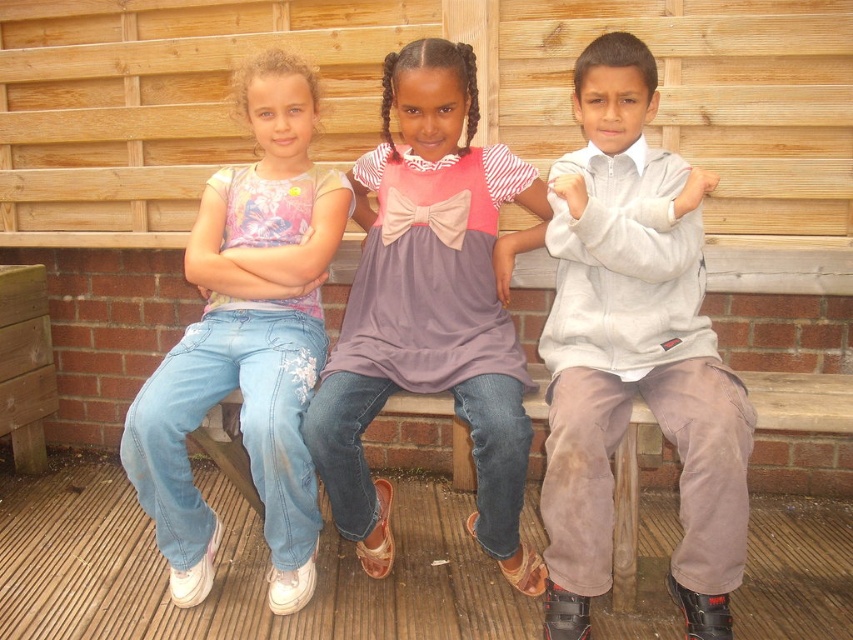
You are a photographer setting up for a group photo. You need to ensure that the light gray fleece jacket at center and the light blue denim jeans at left are both visible in the frame. Based on their positions, which object should you focus on first to capture both?

The light gray fleece jacket at center is to the right of light blue denim jeans at left. To capture both in the frame, focus on the light blue denim jeans at left first, then adjust to include the light gray fleece jacket at center to the right of it.

You are a photographer setting up for a group photo. You need to position yourself so that both the pink satin dress at center and the light blue denim jeans at left are in focus. Which object should you focus on first to ensure both are sharp?

You should focus on the pink satin dress at center first since it is closer to the viewer than the light blue denim jeans at left. By focusing on the closer object, the farther one will also be in focus due to the depth of field.

You are a photographer setting up for a group photo. You need to position the light gray fleece jacket at center and the pink satin dress at center so they are both visible in the frame. Which object should be placed on the left side of the camera frame to ensure both are visible?

The pink satin dress at center should be placed on the left side of the camera frame because the light gray fleece jacket at center is to the right of the pink satin dress at center, so positioning the pink satin dress at center on the left ensures both are visible in the frame.